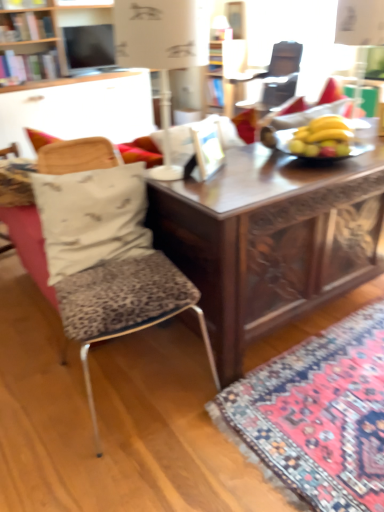
Identify the location of vacant space that is to the left of wooden picture frame at center. (170, 170).